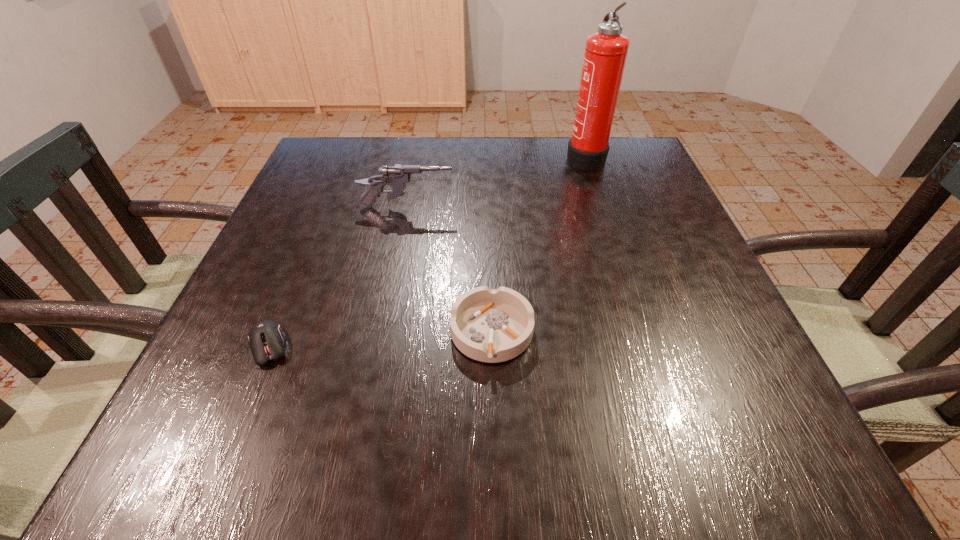
At what (x,y) coordinates should I click in order to perform the action: click on free region located 0.160m at the barrel of the second farthest object. Please return your answer as a coordinate pair (x, y). Image resolution: width=960 pixels, height=540 pixels. Looking at the image, I should click on (524, 207).

Identify the location of free space located on the right of the third object from left to right. (634, 332).

Image resolution: width=960 pixels, height=540 pixels. I want to click on vacant position located 0.390m on the right of the leftmost object, so click(527, 347).

Where is `object situated at the far edge`? This screenshot has width=960, height=540. object situated at the far edge is located at coordinates (605, 55).

Identify the location of object that is positioned at the left edge. The height and width of the screenshot is (540, 960). click(266, 339).

You are a GUI agent. You are given a task and a screenshot of the screen. Output one action in this format:
    pyautogui.click(x=<x>, y=<y>)
    Task: Click on the object situated at the right edge
    This screenshot has height=540, width=960.
    Given the screenshot: What is the action you would take?
    pyautogui.click(x=605, y=55)

What are the coordinates of `object that is positioned at the far right corner` in the screenshot? It's located at (605, 55).

Where is `free spot at the far edge of the desktop`? free spot at the far edge of the desktop is located at coordinates (444, 141).

The width and height of the screenshot is (960, 540). Identify the location of vacant area at the near edge. (551, 423).

In the image, there is a desktop. Identify the location of free space at the left edge. The width and height of the screenshot is (960, 540). (256, 265).